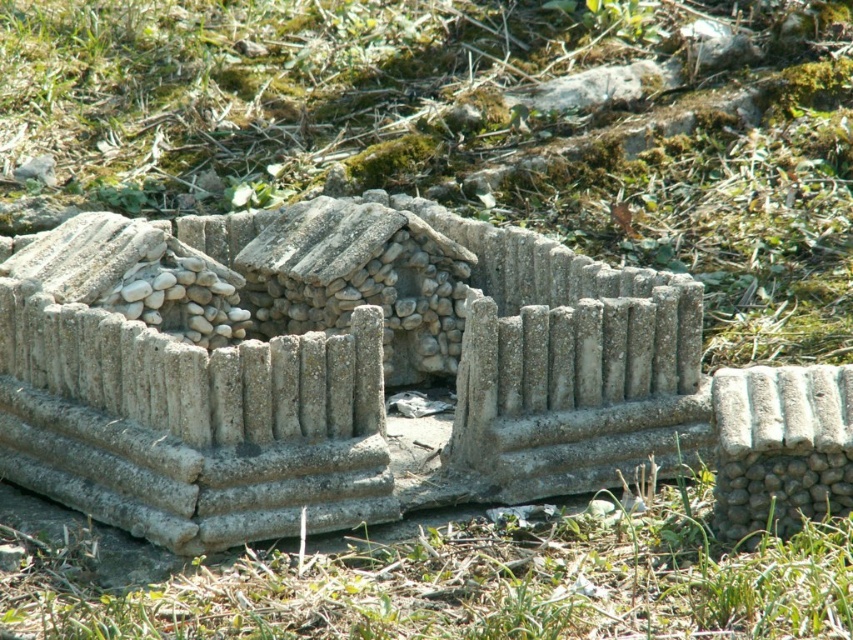
Can you confirm if green grass at center is bigger than green grass at lower center?

Correct, green grass at center is larger in size than green grass at lower center.

Between green grass at center and green grass at lower center, which one is positioned lower?

Positioned lower is green grass at lower center.

Is point (263, 10) behind point (181, 604)?

Yes, point (263, 10) is farther from viewer.

Where is `green grass at center`? The image size is (853, 640). green grass at center is located at coordinates pos(463,132).

Is green grass at center positioned before gray concrete fence at center?

No.

Is point (795, 307) in front of point (677, 458)?

No.

You are a GUI agent. You are given a task and a screenshot of the screen. Output one action in this format:
    pyautogui.click(x=<x>, y=<y>)
    Task: Click on the green grass at center
    
    Given the screenshot: What is the action you would take?
    [463, 132]

Is gray concrete fence at center thinner than green grass at lower center?

Correct, gray concrete fence at center's width is less than green grass at lower center's.

Is gray concrete fence at center to the right of green grass at lower center from the viewer's perspective?

In fact, gray concrete fence at center is to the left of green grass at lower center.

Does point (25, 324) lie in front of point (334, 628)?

No.

Where is `gray concrete fence at center`? This screenshot has width=853, height=640. gray concrete fence at center is located at coordinates (189, 390).